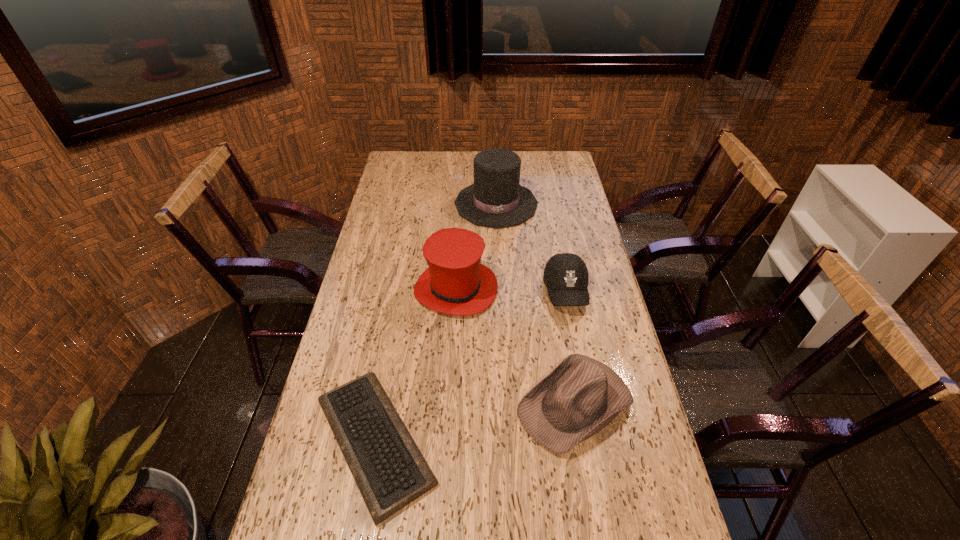
The width and height of the screenshot is (960, 540). I want to click on object at the left edge, so click(x=390, y=472).

Where is `baseball cap present at the right edge`? baseball cap present at the right edge is located at coordinates (566, 277).

This screenshot has width=960, height=540. In order to click on fedora that is at the right edge in this screenshot , I will do `click(581, 396)`.

The height and width of the screenshot is (540, 960). In order to click on vacant space at the left edge of the desktop in this screenshot , I will do `click(389, 187)`.

You are a GUI agent. You are given a task and a screenshot of the screen. Output one action in this format:
    pyautogui.click(x=<x>, y=<y>)
    Task: Click on the free space at the right edge
    The image size is (960, 540).
    Given the screenshot: What is the action you would take?
    pyautogui.click(x=556, y=218)

I want to click on vacant space at the far right corner of the desktop, so click(x=541, y=156).

What are the coordinates of `vacant point located between the baseball cap and the nearer hat` in the screenshot? It's located at (511, 291).

Where is `free point between the fedora and the farthest object`? free point between the fedora and the farthest object is located at coordinates (536, 304).

This screenshot has width=960, height=540. In order to click on empty location between the fedora and the computer keyboard in this screenshot , I will do `click(475, 423)`.

Find the location of a particular element. The height and width of the screenshot is (540, 960). vacant space in between the baseball cap and the nearer hat is located at coordinates (511, 291).